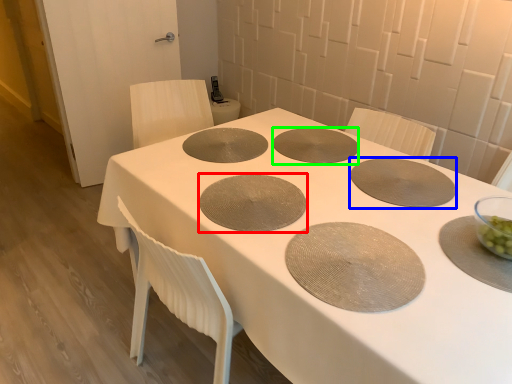
Question: Which is nearer to the pizza pan (highlighted by a red box)? pizza pan (highlighted by a blue box) or pizza pan (highlighted by a green box).

Choices:
 (A) pizza pan
 (B) pizza pan

Answer: (B)